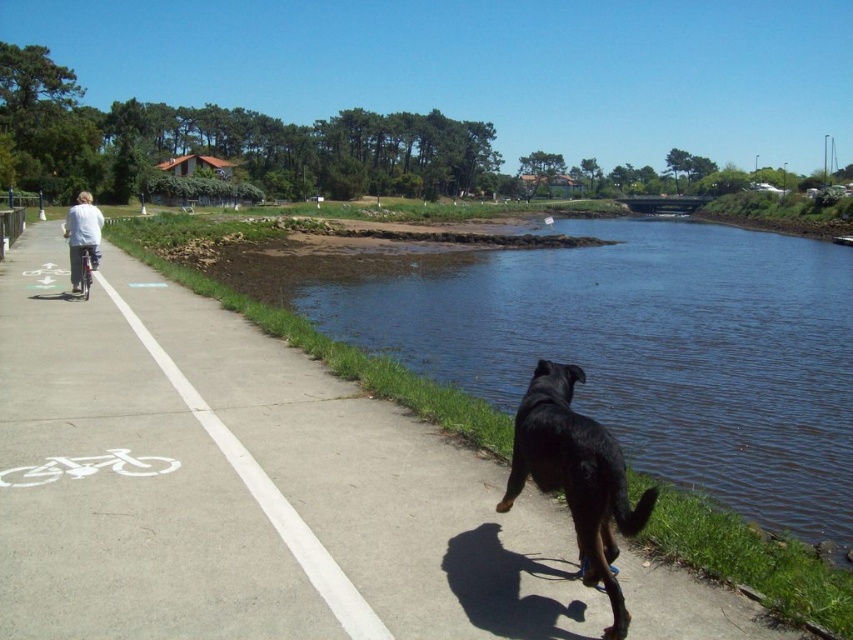
Question: Estimate the real-world distances between objects in this image. Which object is farther from the blue water at lower right?

Choices:
 (A) white cotton shirt at left
 (B) shiny metallic bicycle at left

Answer: (A)

Question: Can you confirm if blue water at lower right is thinner than black glossy dog at lower center?

Choices:
 (A) yes
 (B) no

Answer: (B)

Question: From the image, what is the correct spatial relationship of blue water at lower right in relation to black glossy dog at lower center?

Choices:
 (A) right
 (B) left

Answer: (A)

Question: Is white cotton shirt at left thinner than shiny metallic bicycle at left?

Choices:
 (A) no
 (B) yes

Answer: (A)

Question: Which object is farther from the camera taking this photo?

Choices:
 (A) black glossy dog at lower center
 (B) shiny metallic bicycle at left

Answer: (B)

Question: Which object appears closest to the camera in this image?

Choices:
 (A) white cotton shirt at left
 (B) shiny metallic bicycle at left
 (C) black glossy dog at lower center
 (D) blue water at lower right

Answer: (C)